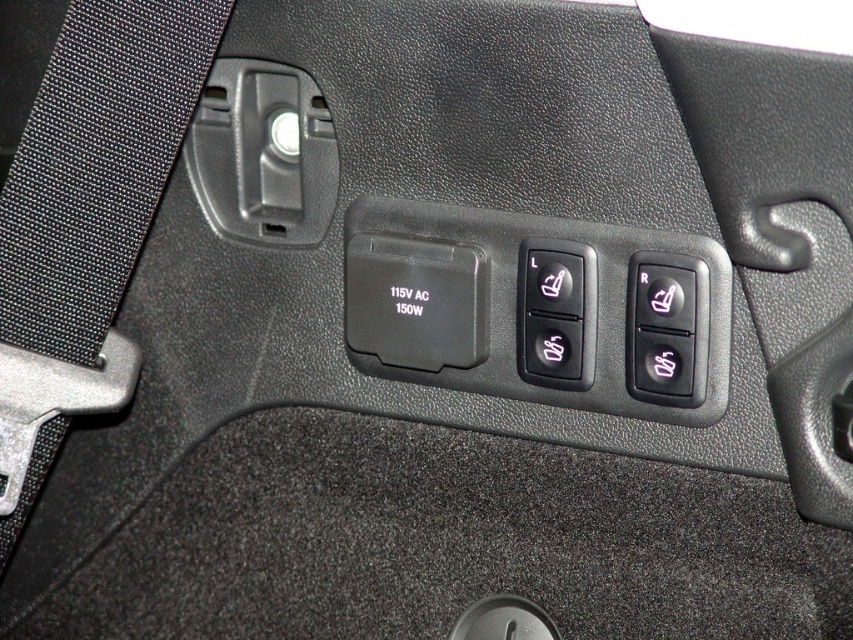
From the picture: You are adjusting your seat in the car and notice two controls. Which one is positioned higher up between the black fabric seatbelt at left and the black plastic seat adjustment button at right?

The black fabric seatbelt at left is positioned higher up than the black plastic seat adjustment button at right.

Looking at this image, you are sitting in the driver seat and need to locate the black plastic button at center. According to the car manual, this button is located at point (556, 314). Can you confirm if this button is within the control panel area?

Yes, the black plastic button at center is located at point (556, 314), which is within the control panel area.

You are a passenger in the car and need to locate the black fabric seatbelt at left and the black plastic button at center. Which object is taller?

The black fabric seatbelt at left is much taller than the black plastic button at center.